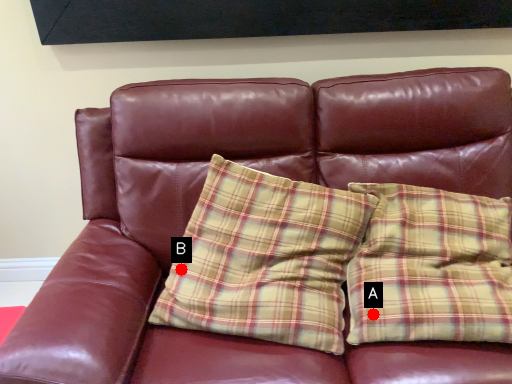
Question: Two points are circled on the image, labeled by A and B beside each circle. Which point is closer to the camera?

Choices:
 (A) A is closer
 (B) B is closer

Answer: (A)